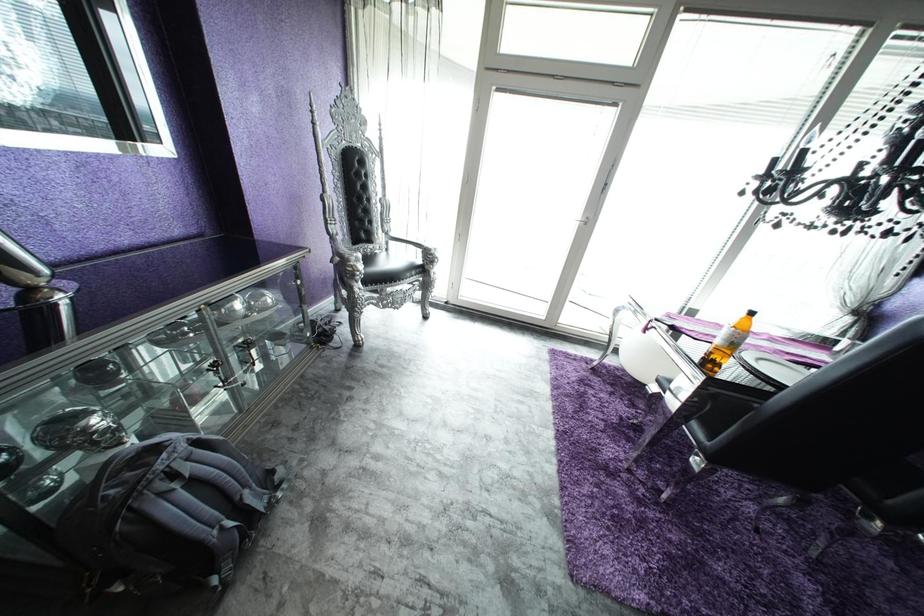
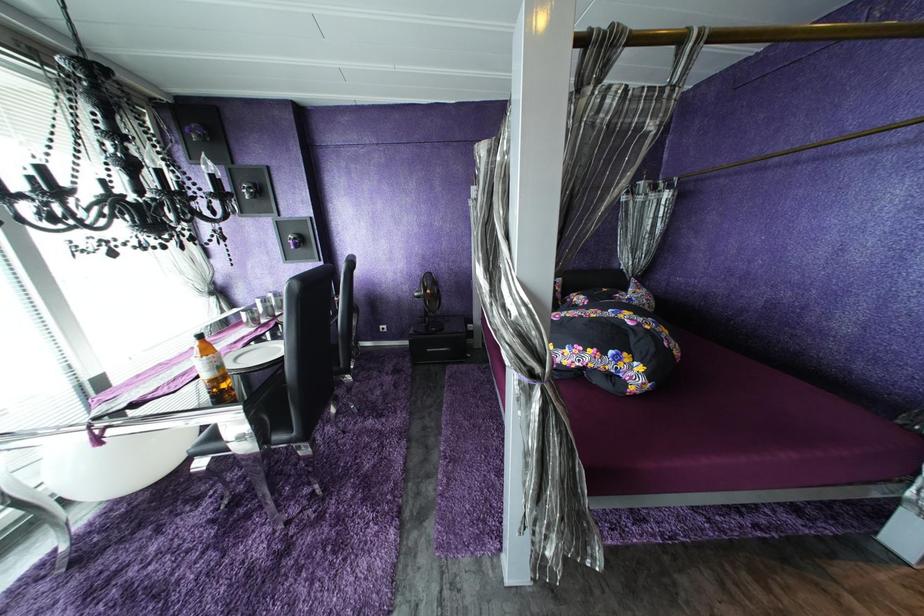
How did the camera likely rotate?

The camera rotated toward right-down.